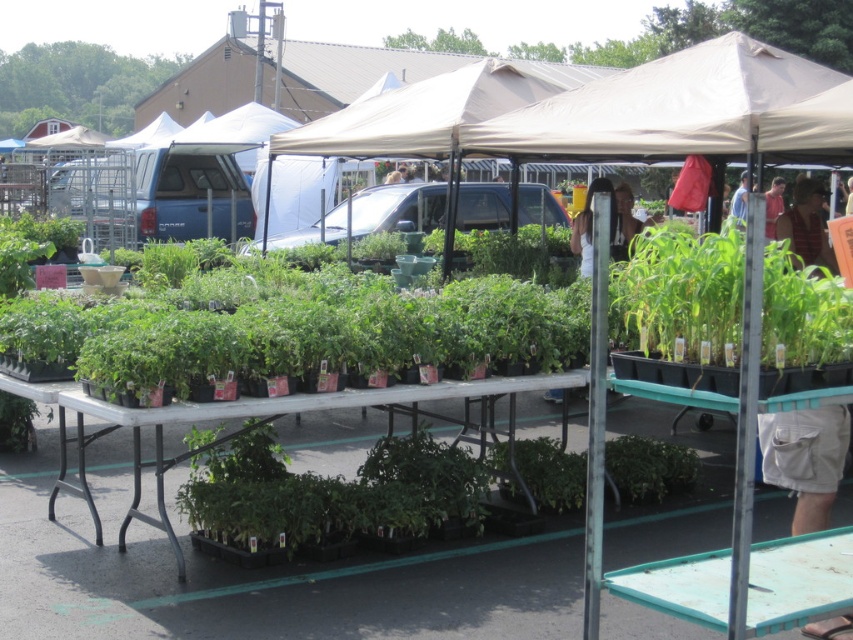
You are standing at the entrance of the farmer market and see the beige fabric tent at center. Can you tell me what is located at the point with coordinates (410, 116)?

The beige fabric tent at center is located at point (410, 116).